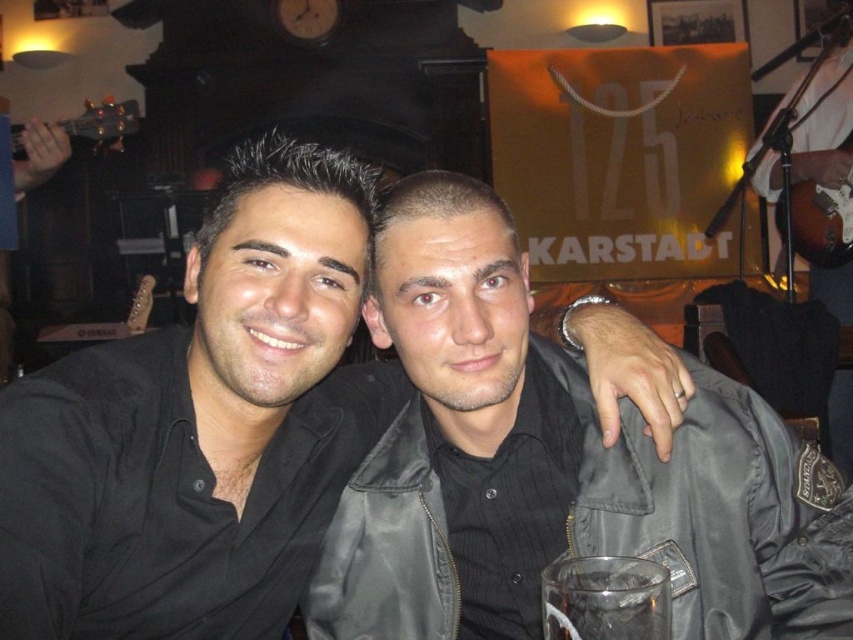
You are at a social event and want to find the black leather jacket at center. The coordinates given are point (717, 509). Can you confirm if this point is located at the center of the image?

The point (717, 509) indicates the location of the black leather jacket at center, so yes, this coordinate is at the center of the image where the black leather jacket is positioned.

In the scene shown: You are a photographer standing 40 inches away from the subjects in the image. You want to take a closeup shot of the black matte shirt at center. Is the current distance sufficient to focus on the shirt clearly?

The black matte shirt at center is 35.73 inches away from the viewer. Since you are standing 40 inches away, you are farther than the shirt, so you need to move closer to 35.73 inches to focus on it properly.